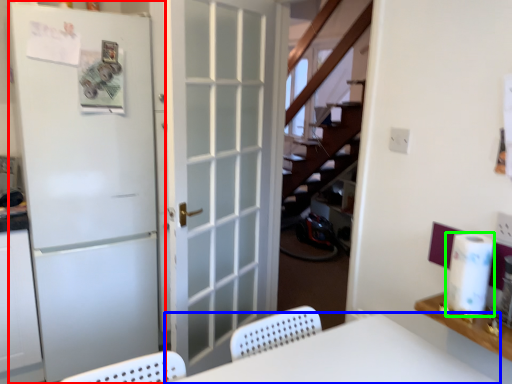
Question: Which is nearer to the door (highlighted by a red box)? furniture (highlighted by a blue box) or paper towel (highlighted by a green box).

Choices:
 (A) furniture
 (B) paper towel

Answer: (A)